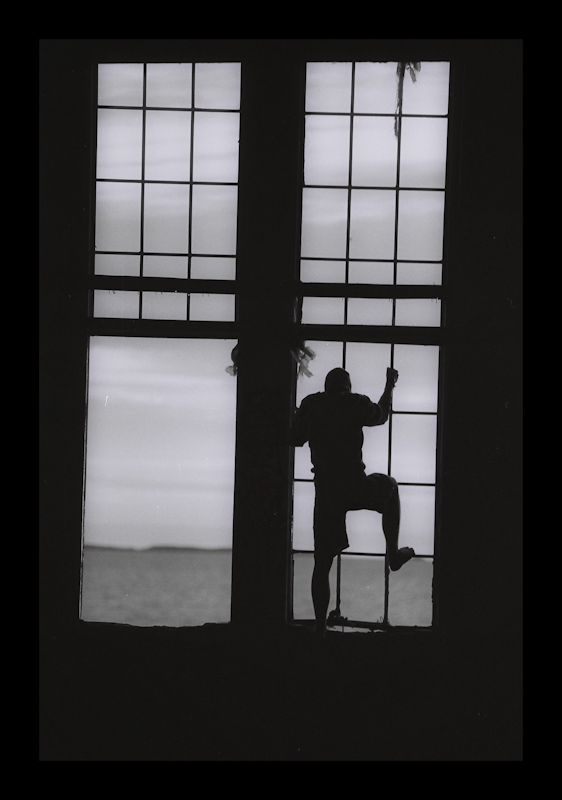
The height and width of the screenshot is (800, 562). I want to click on upper right window, so click(401, 178).